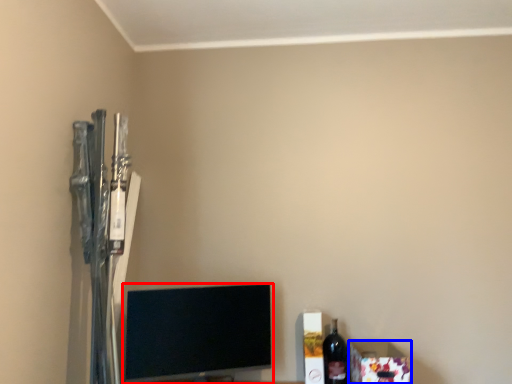
Question: Which point is closer to the camera, television (highlighted by a red box) or box (highlighted by a blue box)?

Choices:
 (A) television
 (B) box

Answer: (A)